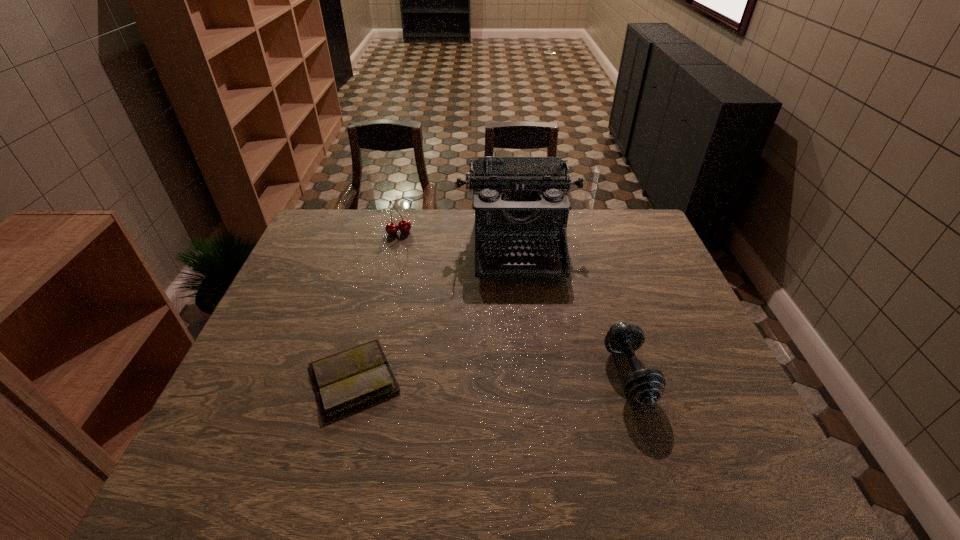
The width and height of the screenshot is (960, 540). In order to click on free location located on the typing side of the tallest object in this screenshot , I will do `click(524, 302)`.

I want to click on vacant space located 0.270m on the typing side of the tallest object, so click(x=529, y=354).

I want to click on cherry located at the far edge, so click(404, 226).

What are the coordinates of `typewriter that is at the far edge` in the screenshot? It's located at (519, 201).

This screenshot has width=960, height=540. I want to click on diary present at the near edge, so click(x=345, y=381).

Where is `dumbbell located in the near edge section of the desktop`? Image resolution: width=960 pixels, height=540 pixels. dumbbell located in the near edge section of the desktop is located at coordinates (644, 386).

Where is `free location at the far edge of the desktop`? Image resolution: width=960 pixels, height=540 pixels. free location at the far edge of the desktop is located at coordinates (467, 245).

Locate an element on the screen. The height and width of the screenshot is (540, 960). free region at the near edge is located at coordinates (432, 414).

This screenshot has height=540, width=960. Identify the location of blank space at the left edge of the desktop. (277, 395).

I want to click on vacant space at the right edge, so click(699, 350).